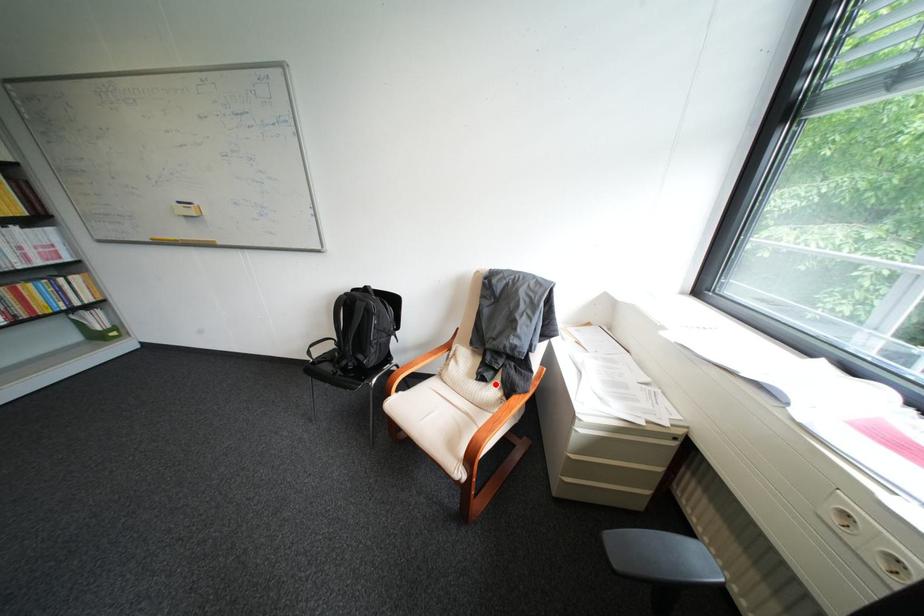
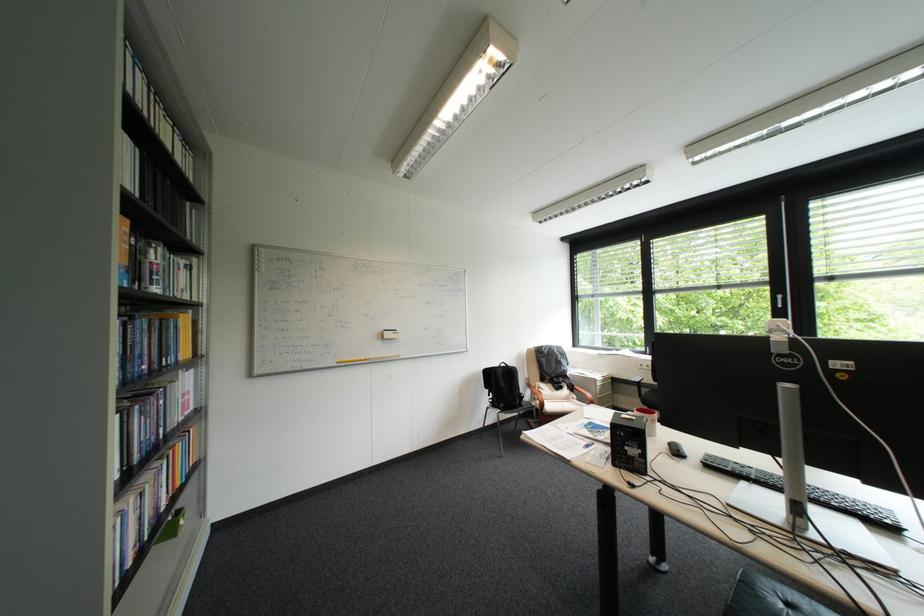
Find the pixel in the second image that matches the highlighted location in the first image.

(573, 391)